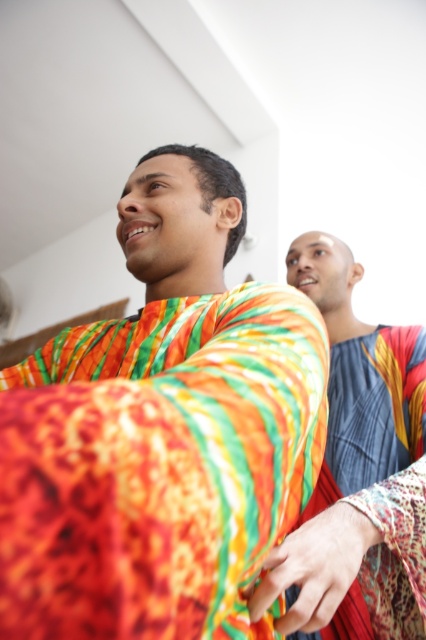
Which is above, textured vibrant shirt at center or textured blue fabric at upper right?

Positioned higher is textured vibrant shirt at center.

In the scene shown: Does textured vibrant shirt at center lie behind textured blue fabric at upper right?

No, textured vibrant shirt at center is in front of textured blue fabric at upper right.

Find the location of a particular element. The height and width of the screenshot is (640, 426). textured vibrant shirt at center is located at coordinates (x=161, y=432).

Where is `textured vibrant shirt at center`? The width and height of the screenshot is (426, 640). textured vibrant shirt at center is located at coordinates (161, 432).